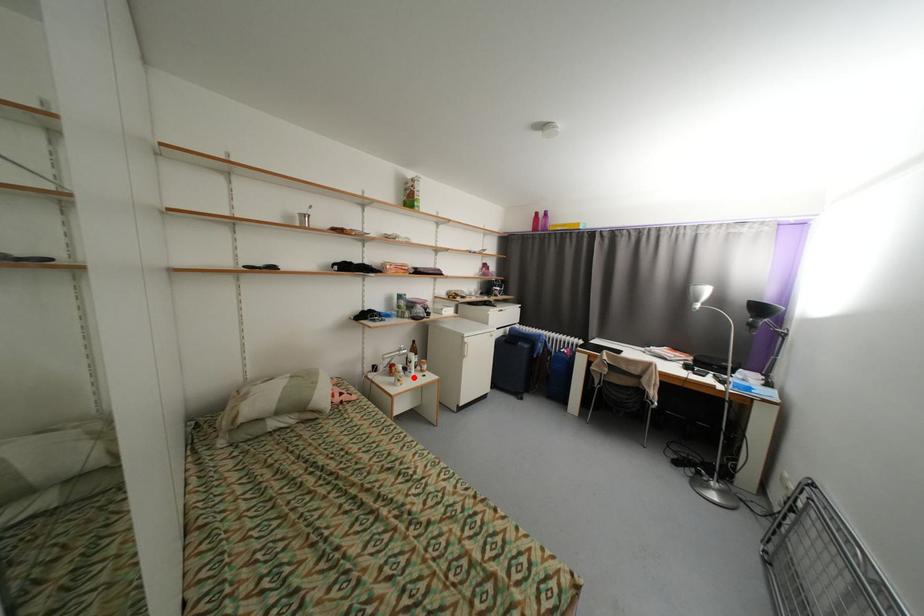
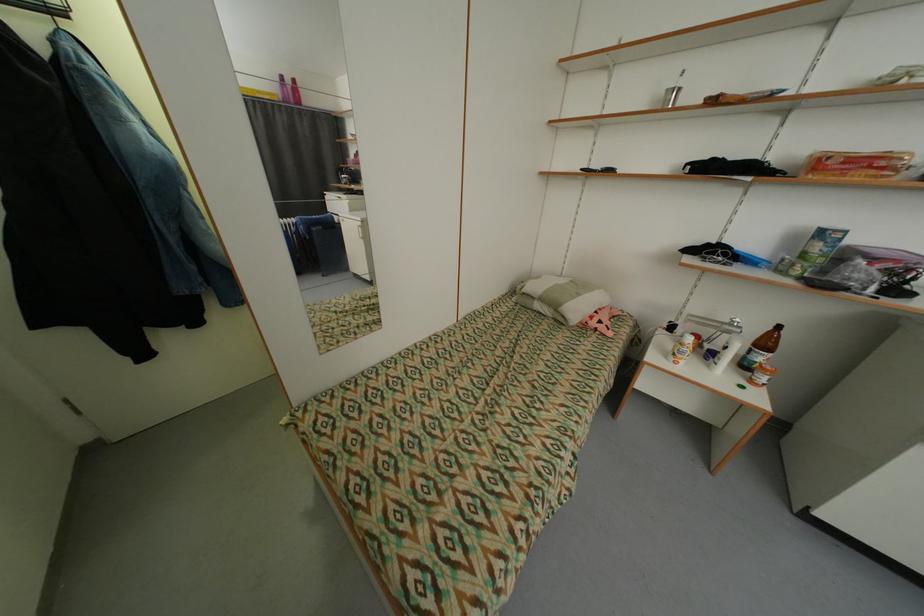
The point at the highlighted location is marked in the first image. Where is the corresponding point in the second image?

(714, 367)